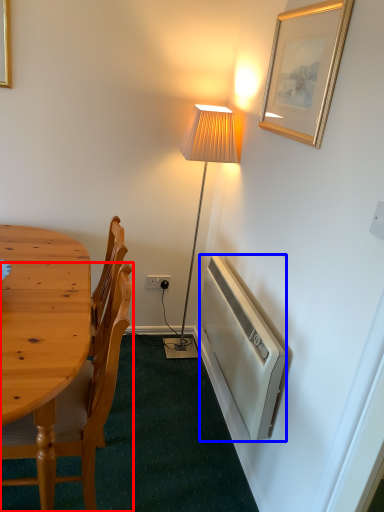
Question: Which object is further to the camera taking this photo, chair (highlighted by a red box) or radiator (highlighted by a blue box)?

Choices:
 (A) chair
 (B) radiator

Answer: (B)